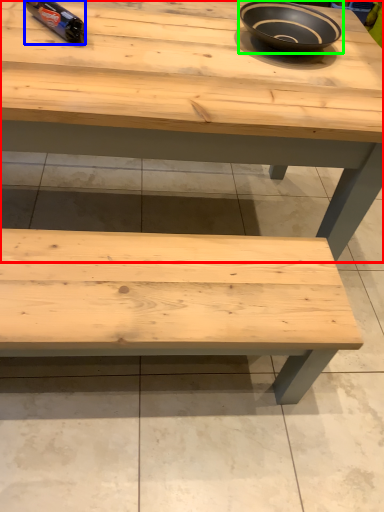
Question: Which object is the closest to the table (highlighted by a red box)? Choose among these: bottle (highlighted by a blue box) or bowl (highlighted by a green box).

Choices:
 (A) bottle
 (B) bowl

Answer: (B)